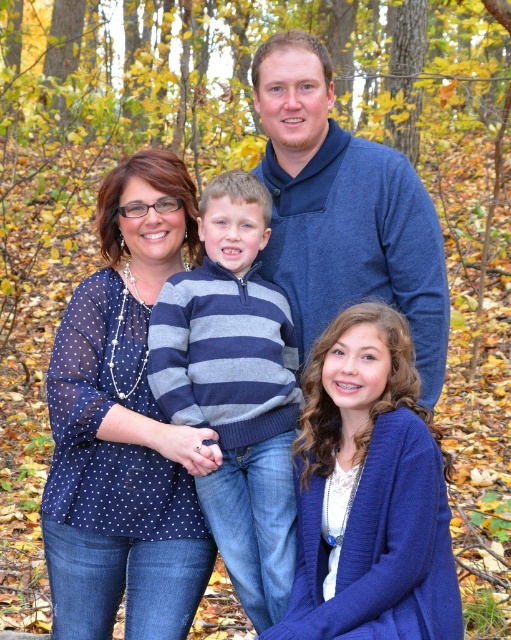
You are a photographer trying to adjust the lighting for a family photo. You notice the blue knitted cardigan at lower right and the striped knit sweater at center. Which item is closer to the camera?

The blue knitted cardigan at lower right is closer to the camera because it is in front of the striped knit sweater at center.

You are a photographer trying to frame a shot of the family. You notice the polka dot sheer blouse at center and the blue sweater at center. Which clothing item is narrower in width?

The polka dot sheer blouse at center is narrower in width than the blue sweater at center.